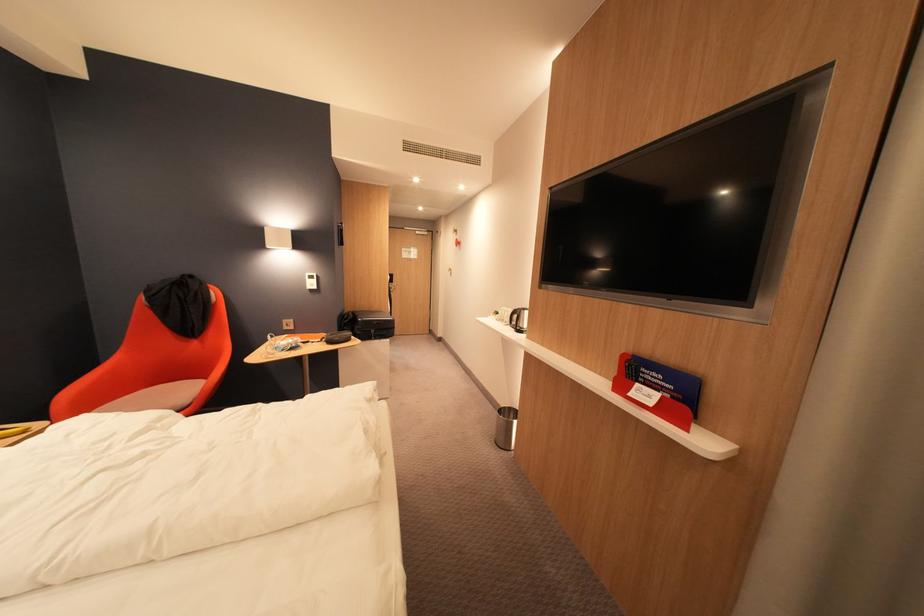
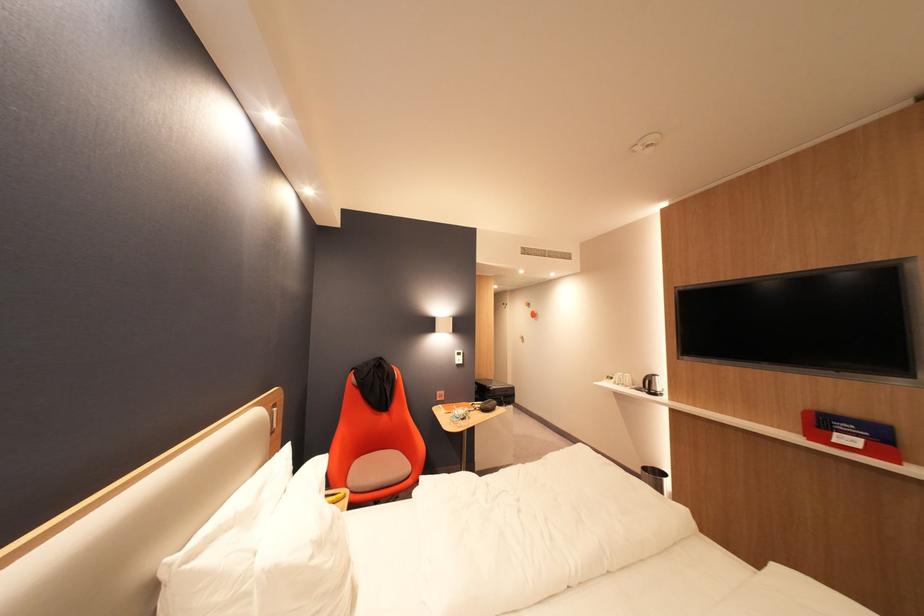
In the second image, find the point that corresponds to point (528, 330) in the first image.

(662, 392)